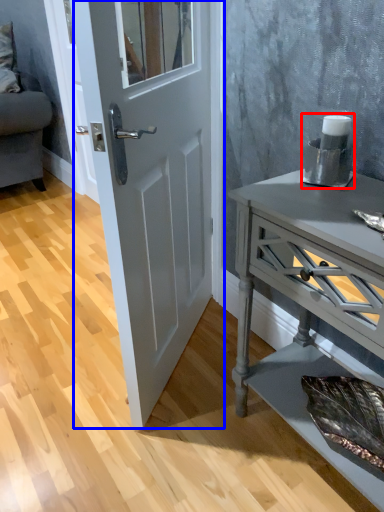
Question: Which object is closer to the camera taking this photo, appliance (highlighted by a red box) or door (highlighted by a blue box)?

Choices:
 (A) appliance
 (B) door

Answer: (B)